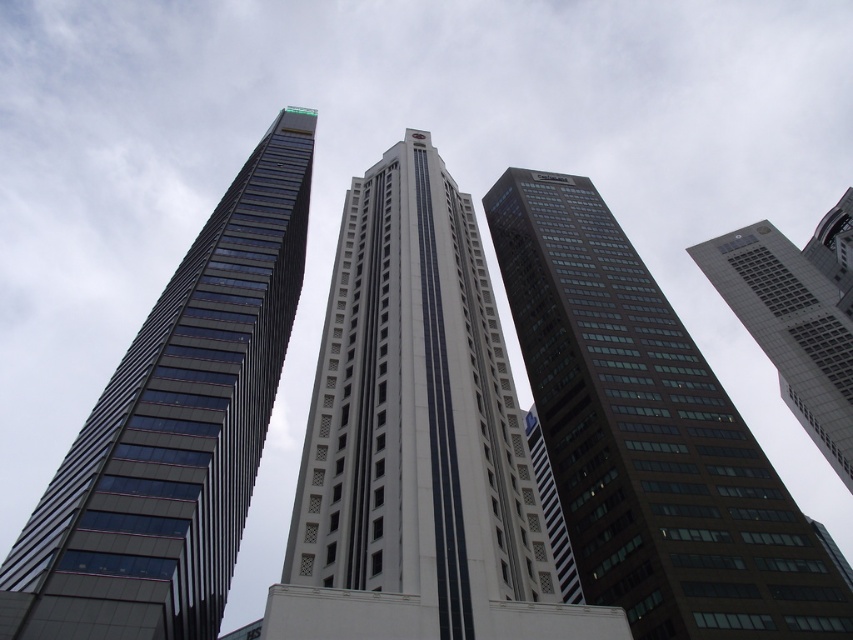
You are standing at the center of the image and want to locate the glassy reflective skyscraper at center. According to the coordinates provided, what are the exact coordinates where you should look to find it?

The glassy reflective skyscraper at center is located at point (416, 440).

You are a drone operator trying to deliver a package to the glassy reflective skyscraper at left. Your drone is currently at point [175,428]. Is the glassy reflective skyscraper at left located to the north or south of your current position?

The glassy reflective skyscraper at left is located at point [175,428], which is your current position. Therefore, you are already at the glassy reflective skyscraper at left.

You are standing at the origin point of a coordinate system placed at the bottom left corner of the image. You want to locate the glassy reflective skyscraper at center. What are its coordinates?

The glassy reflective skyscraper at center is located at coordinates point (416, 440).